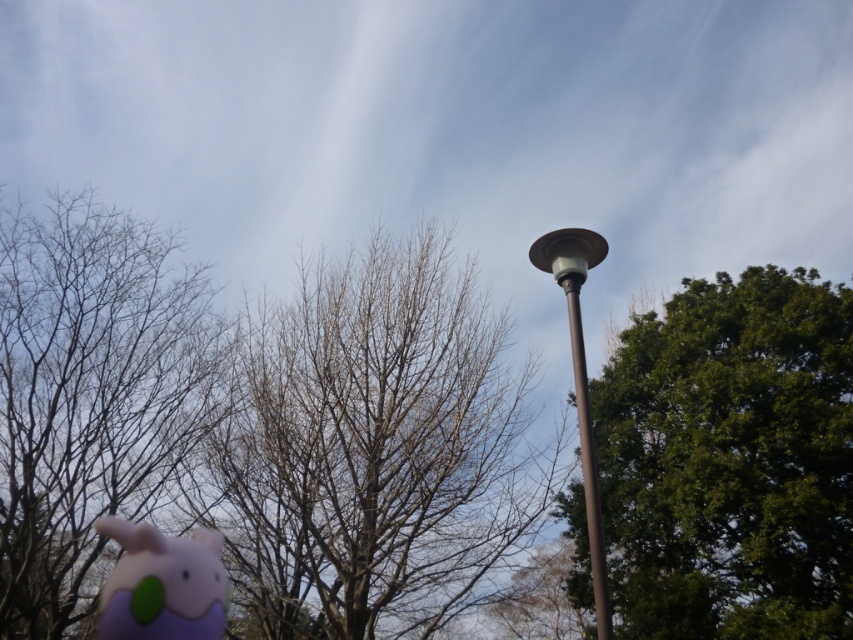
You are standing in the outdoor scene and want to move from point A to point B. Point A is at coordinates point [134,502] and point B is at coordinates point [154,541]. Which point is closer to you?

Point [134,502] is closer to you because it is further to the viewer than point [154,541].

You are standing in a park and see the purple felt plushie at lower left and the brown metallic pole at center. Which object is closer to your left side?

The purple felt plushie at lower left is closer to your left side because it is positioned on the left side of the brown metallic pole at center.